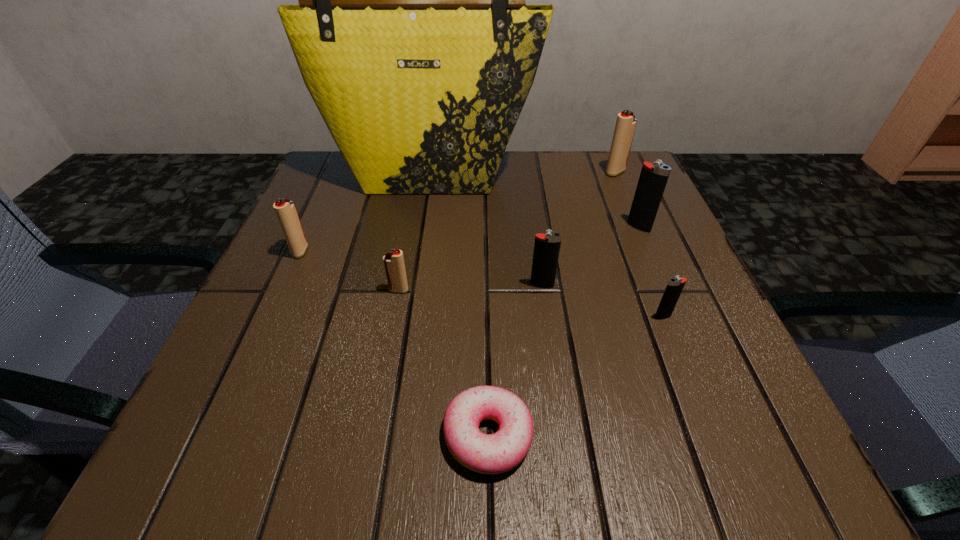
This screenshot has height=540, width=960. In order to click on object at the far right corner in this screenshot , I will do `click(625, 127)`.

In the image, there is a desktop. Where is `vacant space at the far edge`? Image resolution: width=960 pixels, height=540 pixels. vacant space at the far edge is located at coordinates coord(500,185).

The height and width of the screenshot is (540, 960). What are the coordinates of `vacant space at the near edge` in the screenshot? It's located at (570, 425).

Image resolution: width=960 pixels, height=540 pixels. Identify the location of vacant space at the left edge of the desktop. 329,322.

You are a GUI agent. You are given a task and a screenshot of the screen. Output one action in this format:
    pyautogui.click(x=<x>, y=<y>)
    Task: Click on the blank space at the right edge
    
    Given the screenshot: What is the action you would take?
    pyautogui.click(x=678, y=258)

At what (x,y) coordinates should I click in order to perform the action: click on vacant space at the far right corner of the desktop. Please return your answer as a coordinate pair (x, y). Looking at the image, I should click on (585, 171).

The width and height of the screenshot is (960, 540). I want to click on free spot between the second biggest red igniter and the second nearest object, so (482, 284).

Locate an element on the screen. vacant space that is in between the biggest red igniter and the second farthest igniter is located at coordinates (627, 200).

Where is `free space between the smallest black igniter and the second biggest black igniter`? Image resolution: width=960 pixels, height=540 pixels. free space between the smallest black igniter and the second biggest black igniter is located at coordinates (602, 301).

The width and height of the screenshot is (960, 540). In order to click on free space between the pink doughnut and the smallest black igniter in this screenshot , I will do `click(575, 376)`.